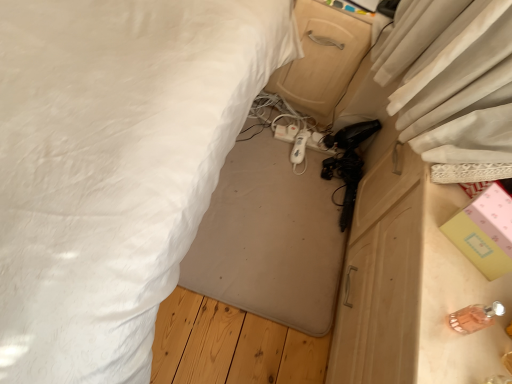
Question: Is white fabric bed at center bigger than wooden drawer at center?

Choices:
 (A) no
 (B) yes

Answer: (B)

Question: From a real-world perspective, is white fabric bed at center below wooden drawer at center?

Choices:
 (A) no
 (B) yes

Answer: (B)

Question: Is white fabric bed at center smaller than wooden drawer at center?

Choices:
 (A) yes
 (B) no

Answer: (B)

Question: Is wooden drawer at center located within white fabric bed at center?

Choices:
 (A) no
 (B) yes

Answer: (A)

Question: Is white fabric bed at center shorter than wooden drawer at center?

Choices:
 (A) yes
 (B) no

Answer: (A)

Question: Is white fabric bed at center completely or partially outside of wooden drawer at center?

Choices:
 (A) no
 (B) yes

Answer: (B)

Question: Can you confirm if white plastic extension cord at center is smaller than pink paper box at right?

Choices:
 (A) no
 (B) yes

Answer: (B)

Question: Are white plastic extension cord at center and pink paper box at right located far from each other?

Choices:
 (A) no
 (B) yes

Answer: (A)

Question: Considering the relative positions of white plastic extension cord at center and pink paper box at right in the image provided, is white plastic extension cord at center to the left of pink paper box at right from the viewer's perspective?

Choices:
 (A) no
 (B) yes

Answer: (B)

Question: Can you confirm if white plastic extension cord at center is thinner than pink paper box at right?

Choices:
 (A) yes
 (B) no

Answer: (A)

Question: Does white plastic extension cord at center lie behind pink paper box at right?

Choices:
 (A) yes
 (B) no

Answer: (A)

Question: From a real-world perspective, does white plastic extension cord at center stand above pink paper box at right?

Choices:
 (A) yes
 (B) no

Answer: (B)

Question: From a real-world perspective, is white matte remote control at center, the 2th equipment from the front, located beneath white plastic extension cord at center?

Choices:
 (A) no
 (B) yes

Answer: (A)